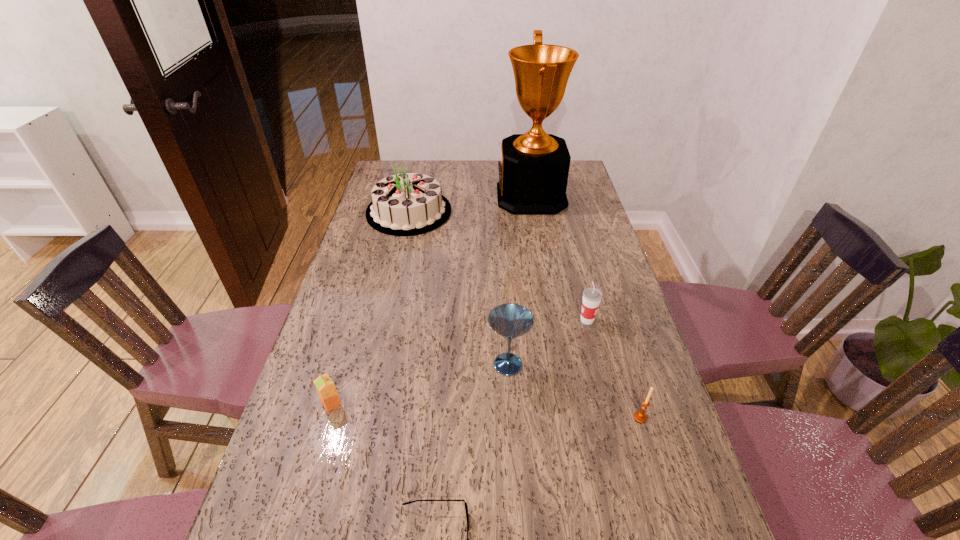
You are a GUI agent. You are given a task and a screenshot of the screen. Output one action in this format:
    pyautogui.click(x=<x>, y=<y>)
    Task: Click on the birthday cake that is at the left edge
    The image size is (960, 540).
    Given the screenshot: What is the action you would take?
    pyautogui.click(x=408, y=204)

Locate an element on the screen. The height and width of the screenshot is (540, 960). orange juice present at the left edge is located at coordinates (325, 387).

At what (x,y) coordinates should I click in order to perform the action: click on trophy cup that is at the right edge. Please return your answer as a coordinate pair (x, y). Looking at the image, I should click on click(533, 172).

Identify the location of cup at the right edge. (592, 296).

I want to click on candle_holder that is at the right edge, so click(640, 416).

You are a GUI agent. You are given a task and a screenshot of the screen. Output one action in this format:
    pyautogui.click(x=<x>, y=<y>)
    Task: Click on the object that is at the far right corner
    Image resolution: width=960 pixels, height=540 pixels.
    Given the screenshot: What is the action you would take?
    pyautogui.click(x=533, y=172)

Locate an element on the screen. This screenshot has height=540, width=960. vacant region at the far edge of the desktop is located at coordinates (477, 163).

Where is `blank space at the left edge of the desktop`? The width and height of the screenshot is (960, 540). blank space at the left edge of the desktop is located at coordinates 307,524.

This screenshot has width=960, height=540. Identify the location of free region at the right edge of the desktop. (583, 195).

What are the coordinates of `blank space at the far left corner of the desktop` in the screenshot? It's located at (380, 176).